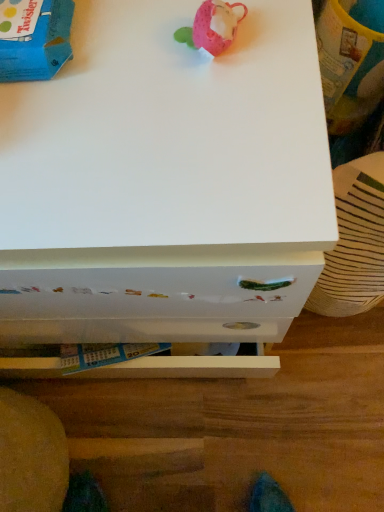
This screenshot has height=512, width=384. What are the coordinates of `free spot to the left of pink fabric mouse at upper center, which is counted as the 1th toy, starting from the right` in the screenshot? It's located at (104, 109).